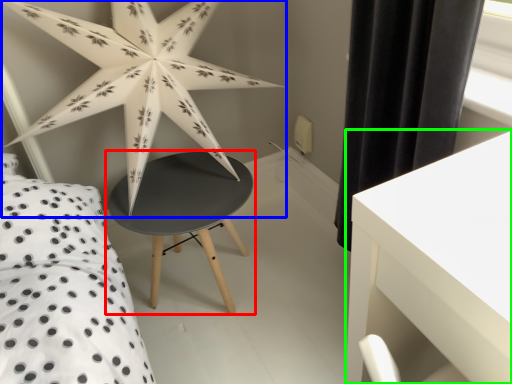
Question: Based on their relative distances, which object is farther from table (highlighted by a red box)? Choose from star (highlighted by a blue box) and table (highlighted by a green box).

Choices:
 (A) star
 (B) table

Answer: (B)